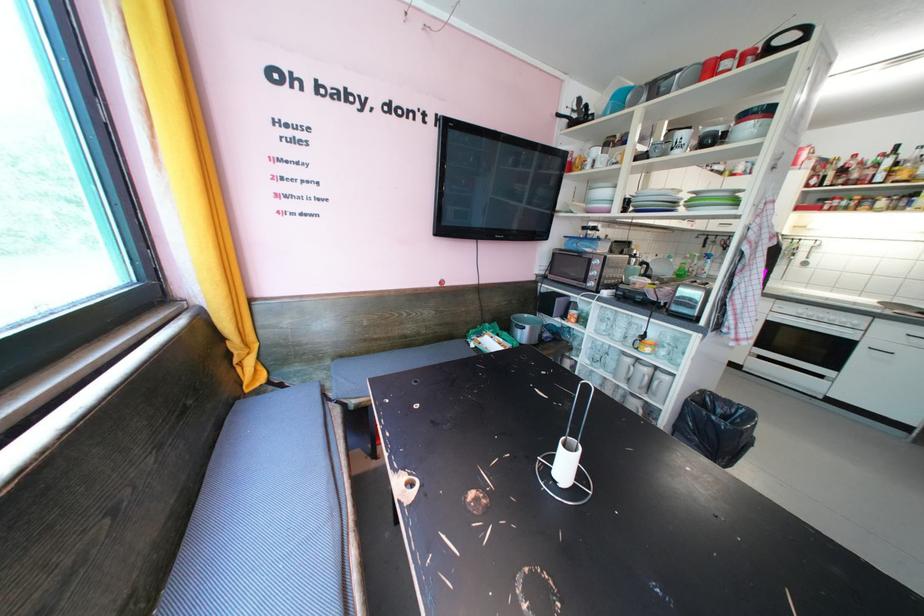
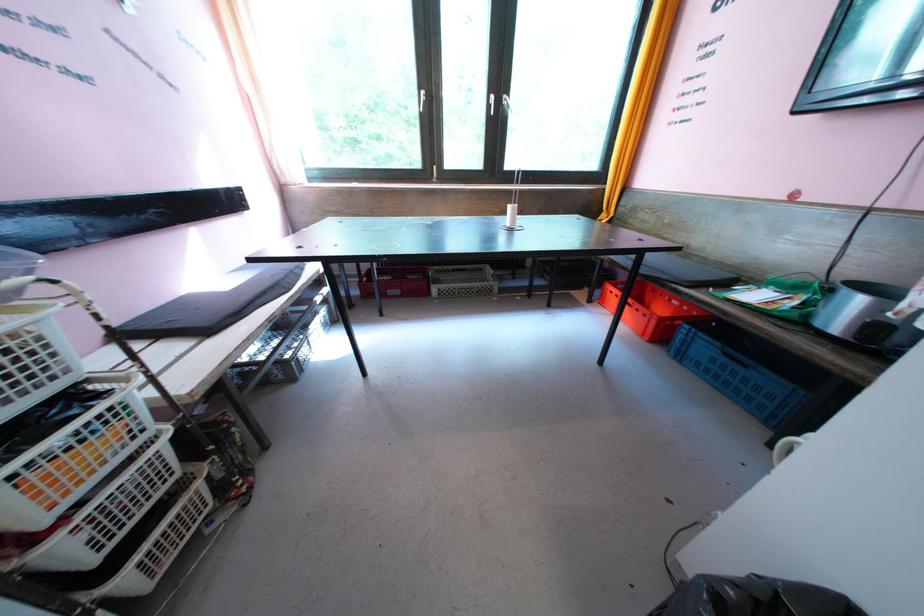
Question: I am providing you with two images of the same scene from different viewpoints. Which of the following objects are not visible in image2?

Choices:
 (A) bench sitting surface
 (B) chrome shower knob
 (C) silver rice cooker
 (D) white window handle

Answer: (A)